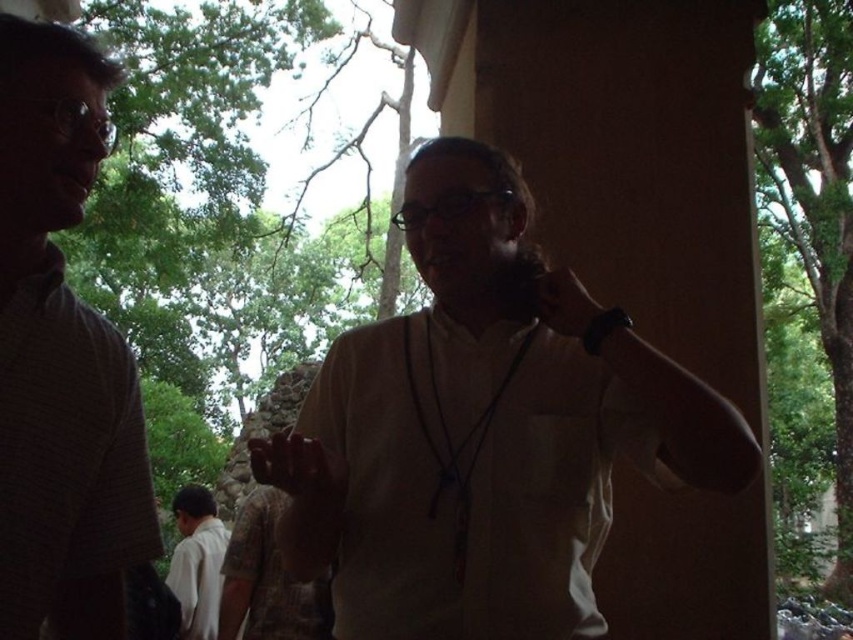
You are standing at the center of the image. A point is marked at coordinates point (814, 196). Based on the scene description, where is this point located?

The point (814, 196) is located on the green leafy tree at upper left.

You are a delivery person needing to place a package between the green leafy tree at upper left and the white cotton shirt at lower left. The package requires a 30 feet space. Is there enough space?

The distance between the green leafy tree at upper left and the white cotton shirt at lower left is 33.88 feet, which is more than the required 30 feet. Therefore, there is enough space to place the package between them.